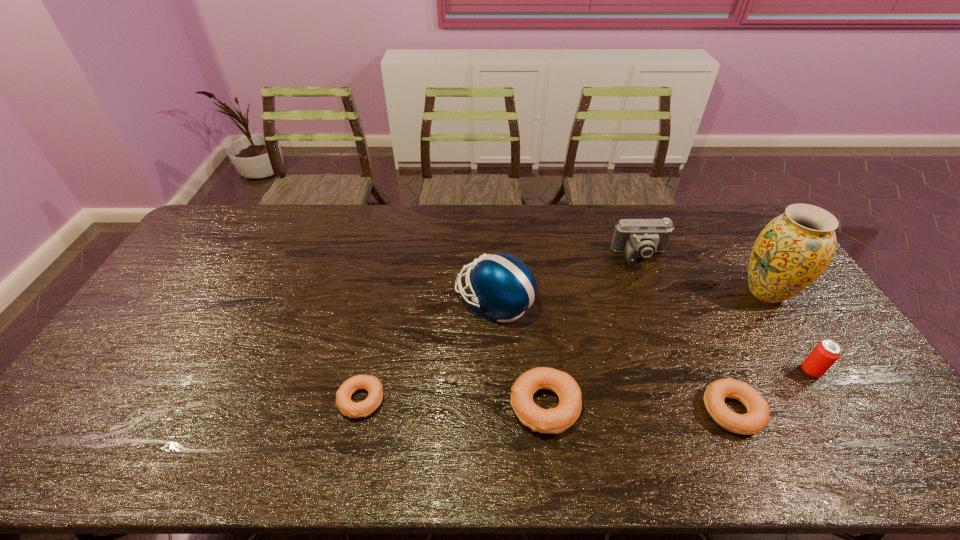
Where is `blank area in the image that satisfies the following two spatial constraints: 1. at the front of the second bagel from left to right with the faceguard; 2. on the left side of the second tallest object`? This screenshot has width=960, height=540. blank area in the image that satisfies the following two spatial constraints: 1. at the front of the second bagel from left to right with the faceguard; 2. on the left side of the second tallest object is located at coordinates (497, 406).

The image size is (960, 540). I want to click on vacant space that satisfies the following two spatial constraints: 1. at the front of the sixth tallest object with the faceguard; 2. on the right side of the football helmet, so click(497, 411).

Find the location of a particular element. This screenshot has width=960, height=540. blank space that satisfies the following two spatial constraints: 1. at the front of the fourth shortest object with an open lens cover; 2. on the left side of the camera is located at coordinates (685, 371).

The image size is (960, 540). I want to click on vacant position in the image that satisfies the following two spatial constraints: 1. on the front side of the third shortest object; 2. on the right side of the shortest bagel, so pyautogui.click(x=360, y=406).

Find the location of a particular element. Image resolution: width=960 pixels, height=540 pixels. vacant space that satisfies the following two spatial constraints: 1. on the front side of the fifth tallest object; 2. on the left side of the leftmost bagel is located at coordinates (360, 406).